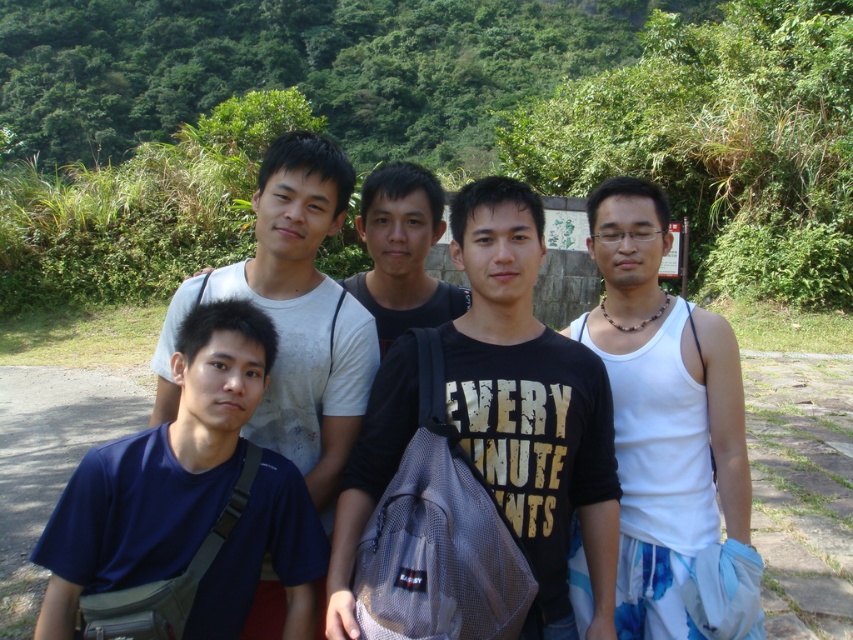
You are a photographer trying to capture a group photo of the five young men in the scene. You want to ensure that both the black mesh backpack at center and the black matte shirt at center are clearly visible in the frame. Given their positions, do you think they can both be in focus simultaneously?

The distance between the black mesh backpack at center and the black matte shirt at center is 1.00 meters. Since they are positioned at the same distance from the camera, they can both be in focus simultaneously in the photograph.